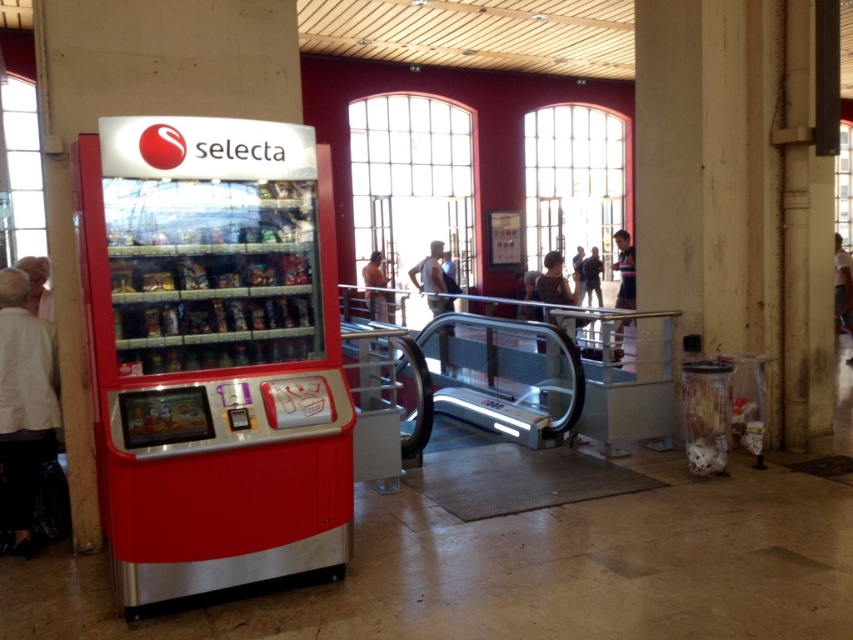
You are standing at the entrance of the train station and want to reach the vending machine labeled selecta. The vending machine is located at point [548,253]. If you walk straight ahead, will you reach the vending machine before reaching a point that is 10 meters away from you?

The distance of point [548,253] from camera is 10.58 meters, so if you walk straight ahead, you will reach the point 10 meters away before reaching the vending machine labeled selecta.

You are standing in the public building and want to locate two specific points marked in the image. Which of the two points, point (560, 259) or point (386, 310), is closer to you?

Point (560, 259) is closer to the viewer than point (386, 310).

Consider the image. You are standing in a public building and see a dark brown leather jacket at center and a smooth skin person at center. Which object is located higher up?

The dark brown leather jacket at center is above the smooth skin person at center.